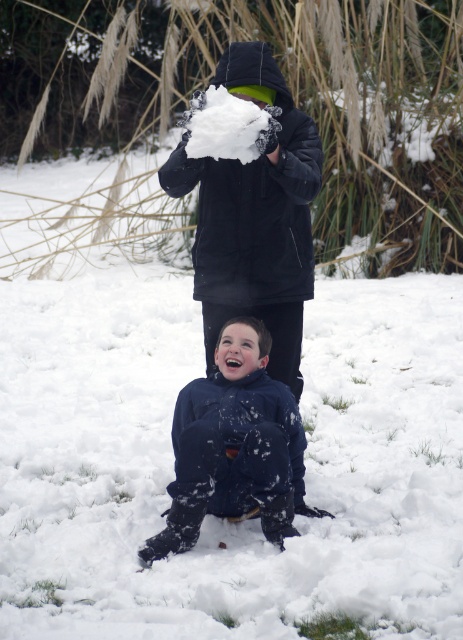
Can you confirm if matte black jacket at upper center is taller than dark blue snowsuit at center?

Yes, matte black jacket at upper center is taller than dark blue snowsuit at center.

Between matte black jacket at upper center and dark blue snowsuit at center, which one is positioned higher?

Positioned higher is matte black jacket at upper center.

Between point (250, 218) and point (262, 508), which one is positioned in front?

Point (262, 508) is more forward.

Find the location of a particular element. Image resolution: width=463 pixels, height=640 pixels. matte black jacket at upper center is located at coordinates (255, 218).